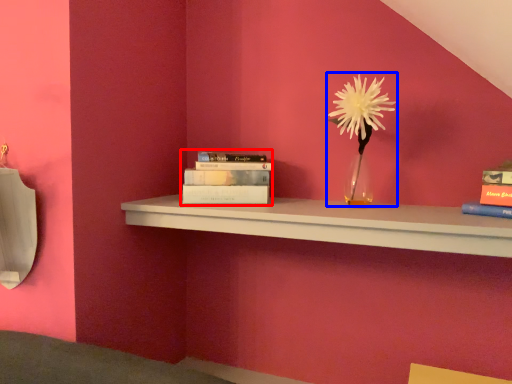
Question: Among these objects, which one is farthest to the camera, book (highlighted by a red box) or floral arrangement (highlighted by a blue box)?

Choices:
 (A) book
 (B) floral arrangement

Answer: (A)